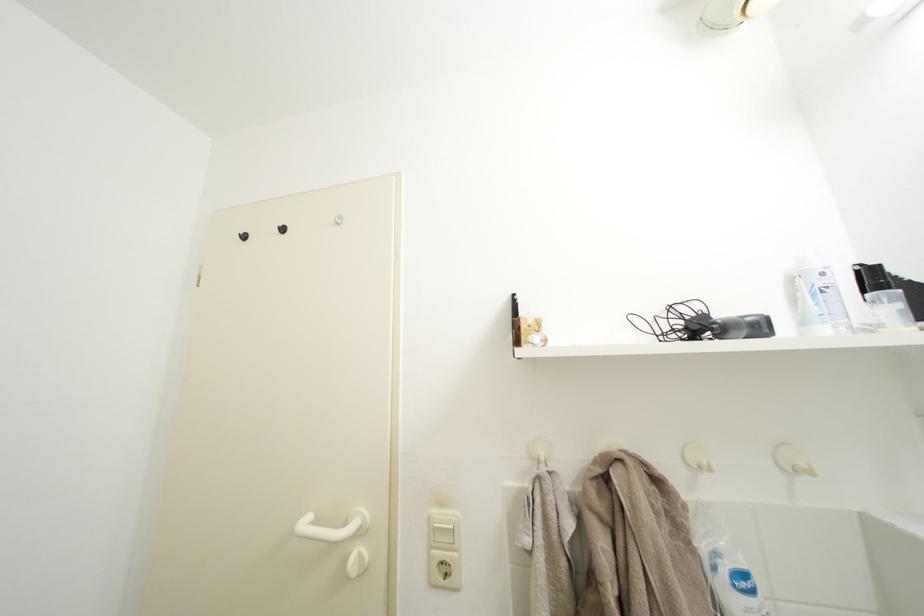
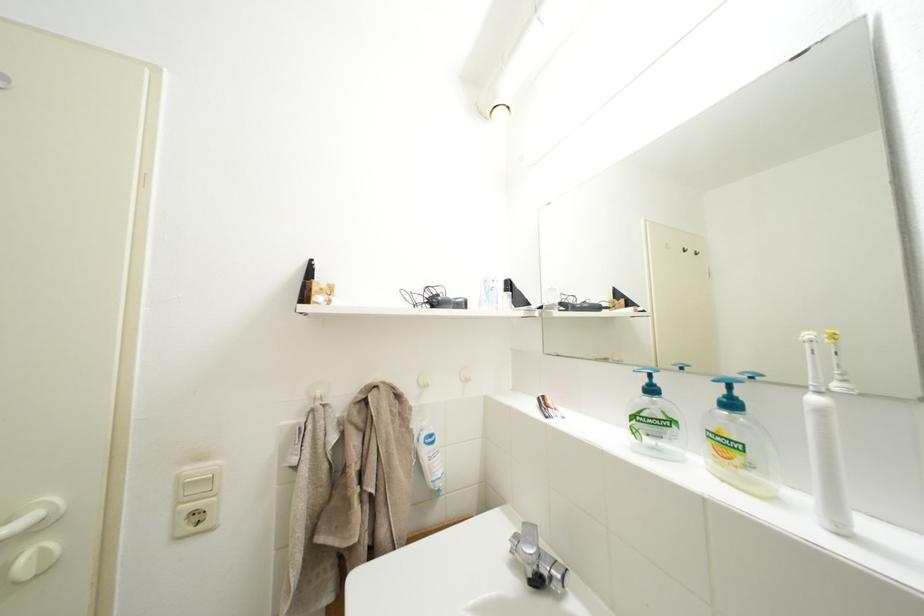
Locate, in the second image, the point that corresponds to the point at 439,562 in the first image.

(185, 519)